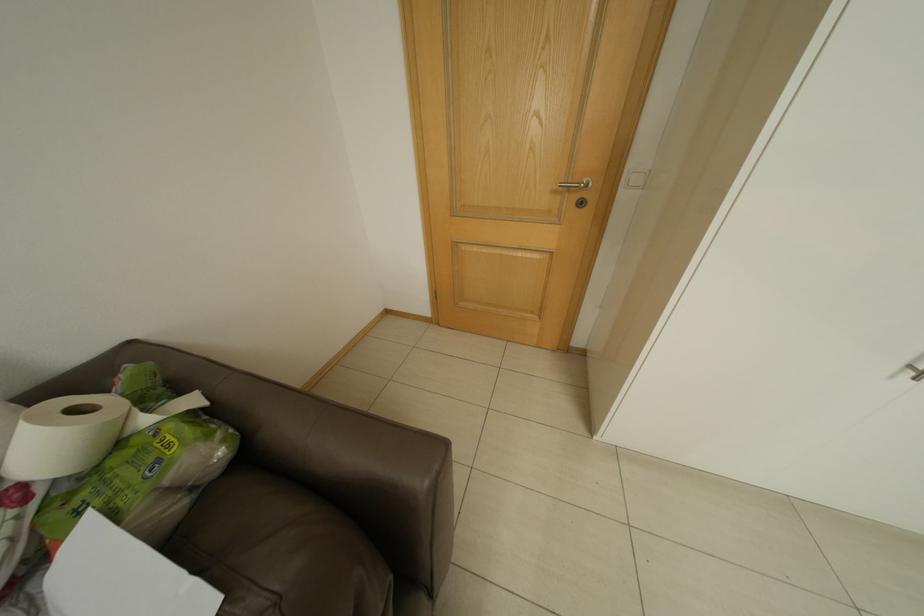
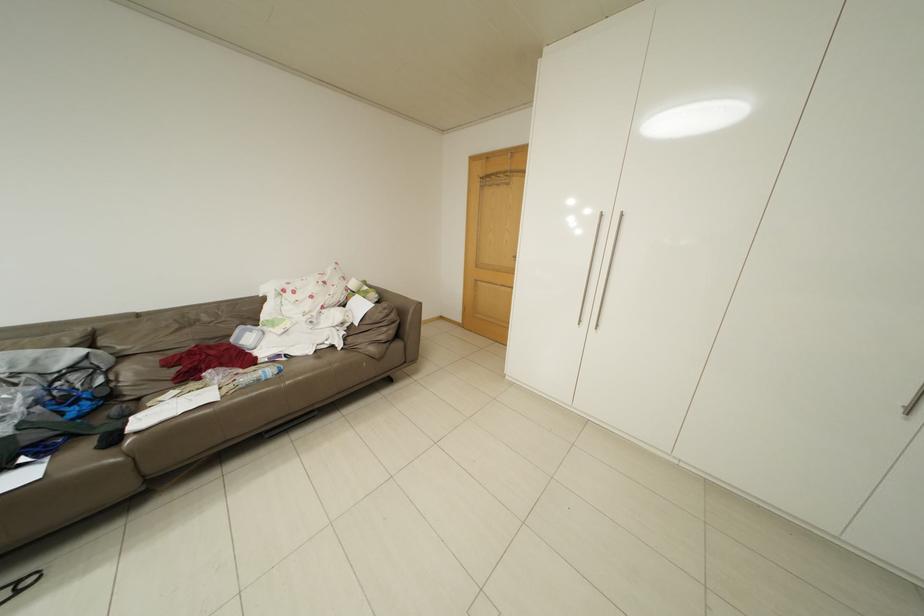
The images are taken continuously from a first-person perspective. In which direction are you moving?

The movement direction of the cameraman is right, backward.